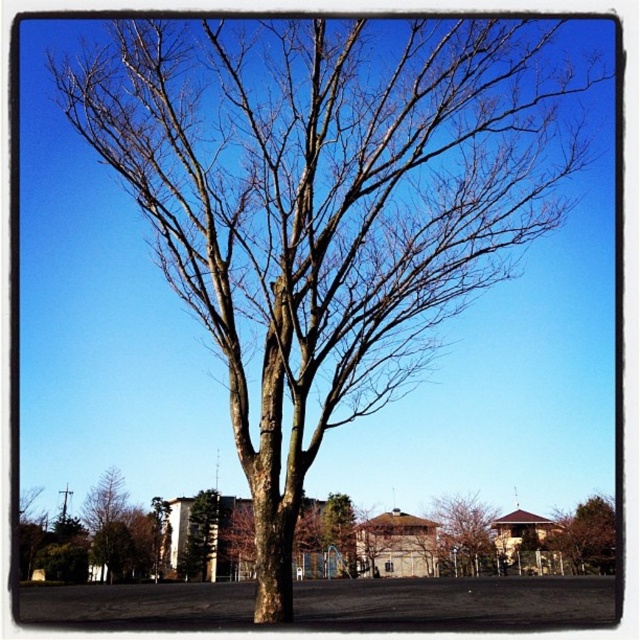
Is brown rough bark tree at lower center to the right of green leafy tree at center from the viewer's perspective?

Yes, brown rough bark tree at lower center is to the right of green leafy tree at center.

What do you see at coordinates (464, 536) in the screenshot?
I see `brown rough bark tree at lower center` at bounding box center [464, 536].

Where is `brown rough bark tree at lower center`? Image resolution: width=640 pixels, height=640 pixels. brown rough bark tree at lower center is located at coordinates (464, 536).

Is brown rough bark tree at lower center to the right of brown rough bark tree at lower right from the viewer's perspective?

Incorrect, brown rough bark tree at lower center is not on the right side of brown rough bark tree at lower right.

Which is more to the left, brown rough bark tree at lower center or brown rough bark tree at lower right?

From the viewer's perspective, brown rough bark tree at lower center appears more on the left side.

Between point (468, 500) and point (566, 536), which one is positioned in front?

Point (566, 536) is more forward.

I want to click on brown rough bark tree at lower center, so click(x=464, y=536).

Is point (592, 520) closer to viewer compared to point (88, 508)?

No, (592, 520) is further to viewer.

You are a GUI agent. You are given a task and a screenshot of the screen. Output one action in this format:
    pyautogui.click(x=<x>, y=<y>)
    Task: Click on the brown rough bark tree at lower right
    The width and height of the screenshot is (640, 640).
    Given the screenshot: What is the action you would take?
    pyautogui.click(x=588, y=536)

From the picture: Who is more forward, (561, 536) or (93, 556)?

Point (93, 556) is more forward.

This screenshot has width=640, height=640. What are the coordinates of `brown rough bark tree at lower right` in the screenshot? It's located at (588, 536).